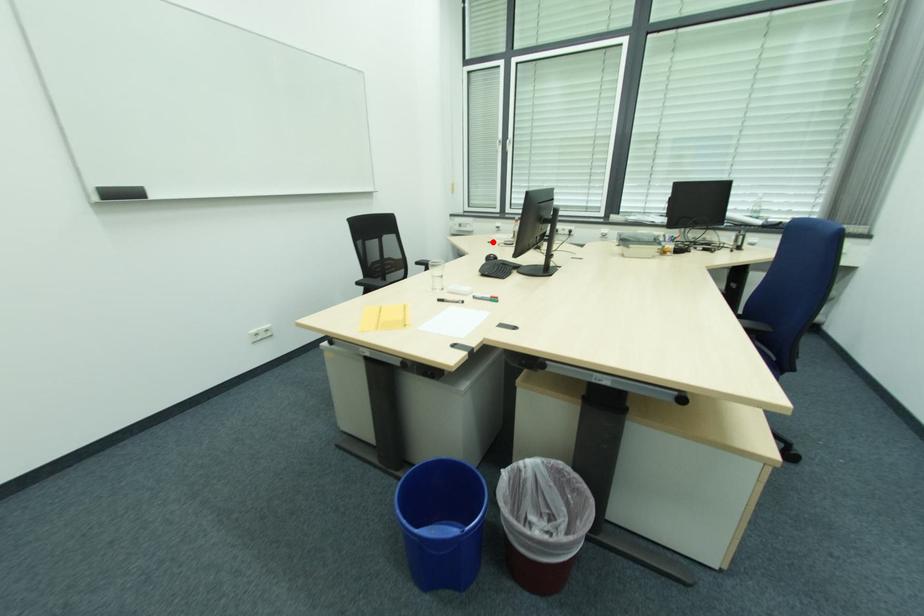
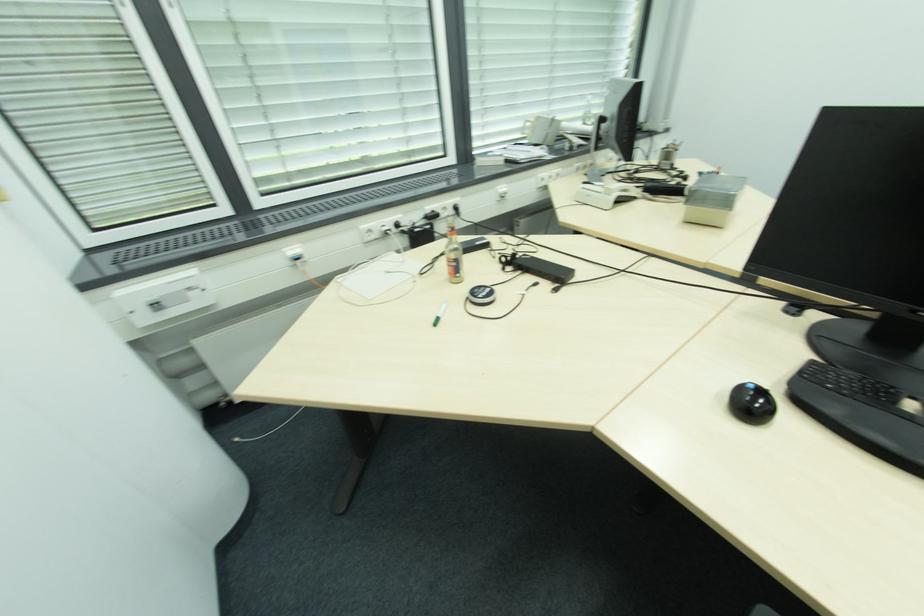
Locate, in the second image, the point that corresponds to the highlighted location in the first image.

(436, 321)